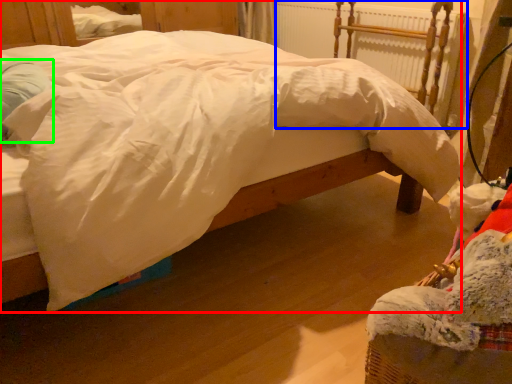
Question: Which object is the farthest from bed (highlighted by a red box)? Choose among these: radiator (highlighted by a blue box) or pillow (highlighted by a green box).

Choices:
 (A) radiator
 (B) pillow

Answer: (A)